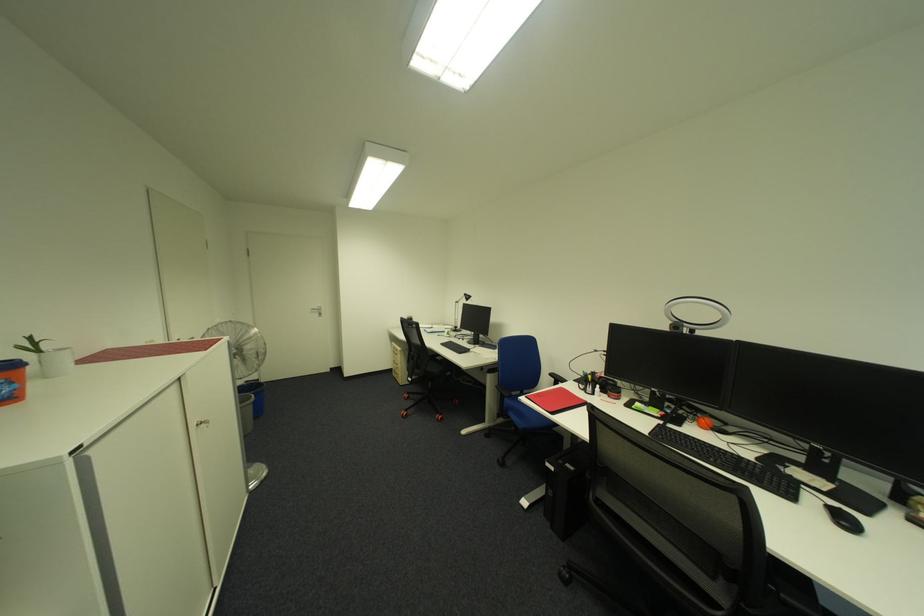
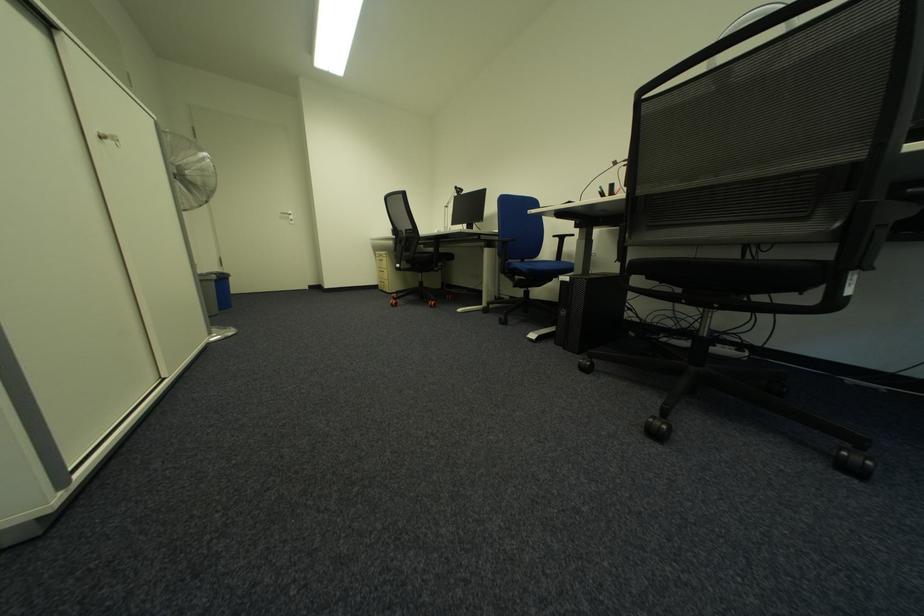
The images are taken continuously from a first-person perspective. In which direction are you moving?

The cameraman moved toward left, forward.